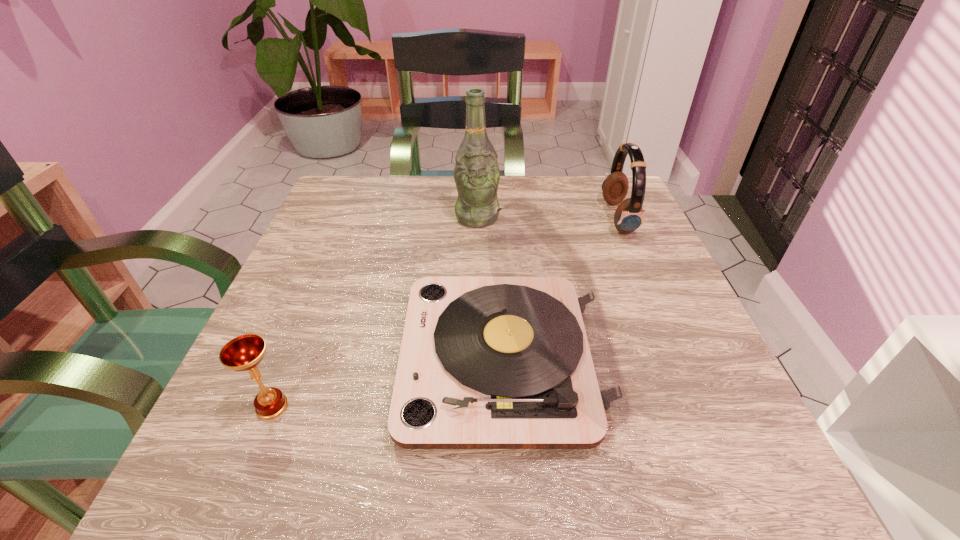
In the image, there is a desktop. Identify the location of vacant area at the far edge. (433, 228).

You are a GUI agent. You are given a task and a screenshot of the screen. Output one action in this format:
    pyautogui.click(x=<x>, y=<y>)
    Task: Click on the free spot at the near edge of the desktop
    
    Given the screenshot: What is the action you would take?
    pyautogui.click(x=336, y=486)

In the image, there is a desktop. Where is `free space at the left edge`? This screenshot has height=540, width=960. free space at the left edge is located at coordinates tap(330, 267).

Identify the location of blank area at the right edge. (682, 308).

Locate an element on the screen. The image size is (960, 540). free spot between the beer bottle and the headset is located at coordinates (547, 218).

You are a GUI agent. You are given a task and a screenshot of the screen. Output one action in this format:
    pyautogui.click(x=<x>, y=<y>)
    Task: Click on the free space between the record player and the chalice
    This screenshot has width=960, height=540.
    Given the screenshot: What is the action you would take?
    pyautogui.click(x=388, y=383)

Image resolution: width=960 pixels, height=540 pixels. Find the location of `vacant point located between the beer bottle and the chalice`. vacant point located between the beer bottle and the chalice is located at coordinates (374, 312).

This screenshot has width=960, height=540. I want to click on free point between the beer bottle and the leftmost object, so click(x=374, y=312).

The height and width of the screenshot is (540, 960). Identify the location of object that is the third closest to the chalice. point(629,215).

Identify which object is the nearest to the record player. Please provide its 2D coordinates. Your answer should be formatted as a tuple, i.e. [(x, y)], where the tuple contains the x and y coordinates of a point satisfying the conditions above.

[(244, 353)]